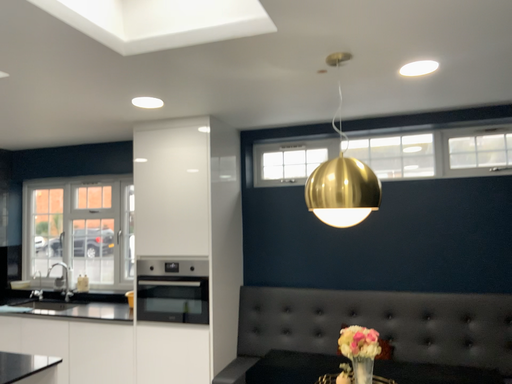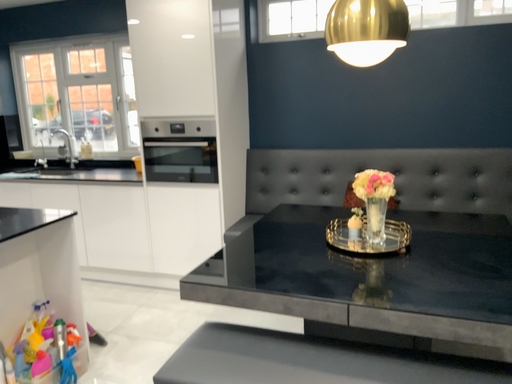
Question: Which way did the camera rotate in the video?

Choices:
 (A) rotated upward
 (B) rotated downward

Answer: (B)